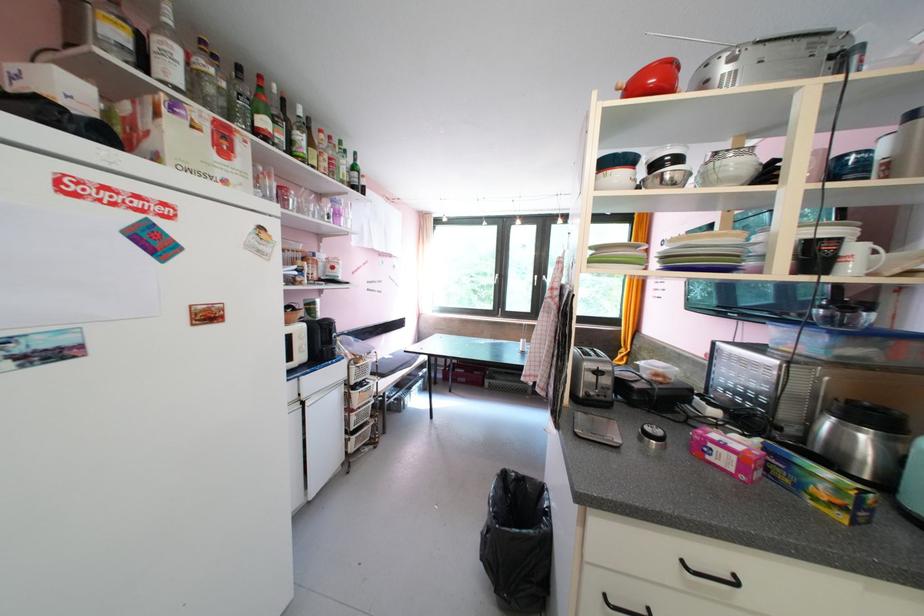
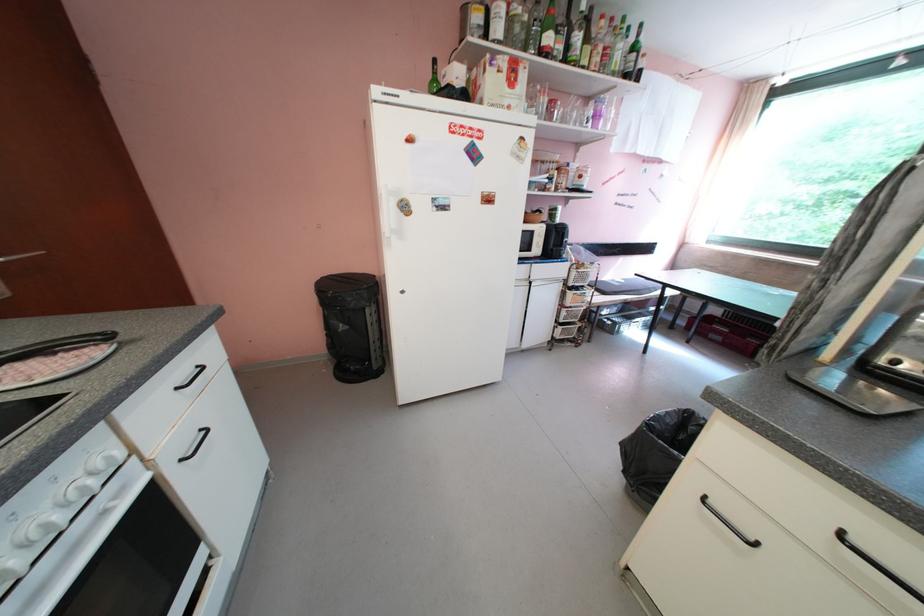
Find the pixel in the second image that matches point (350, 184) in the first image.

(622, 75)